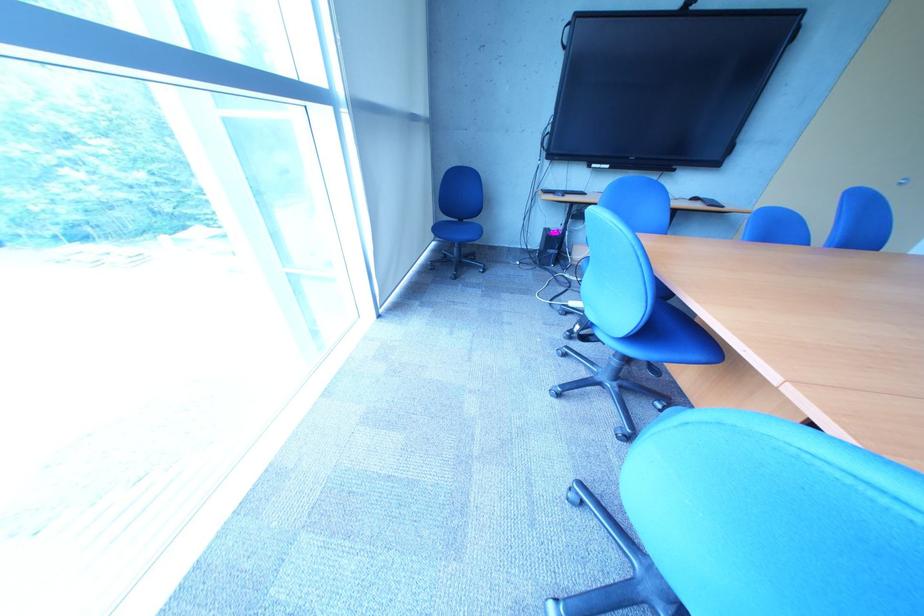
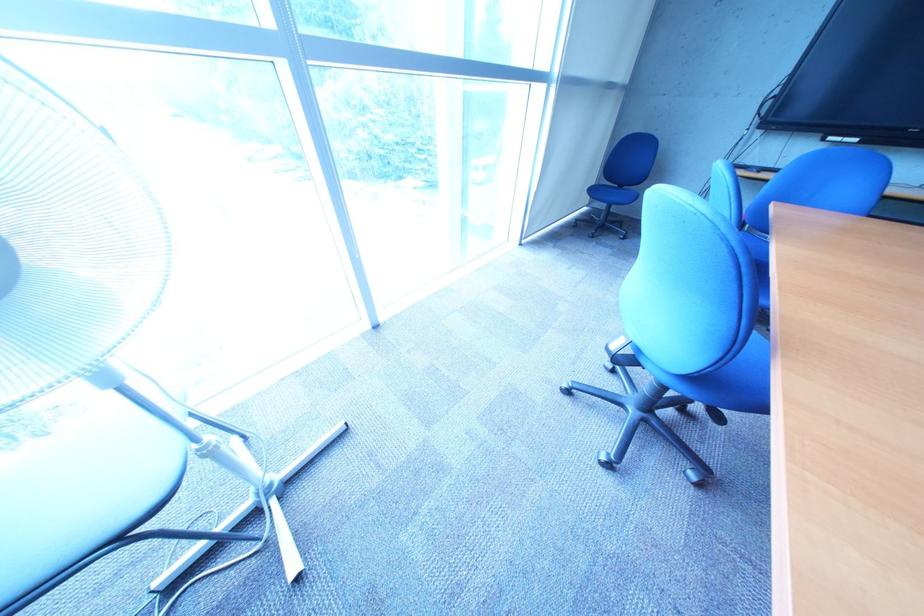
Question: Based on the continuous images, in which direction is the camera rotating? Reply with the corresponding letter.

Choices:
 (A) Left
 (B) Right
 (C) Up
 (D) Down

Answer: (A)